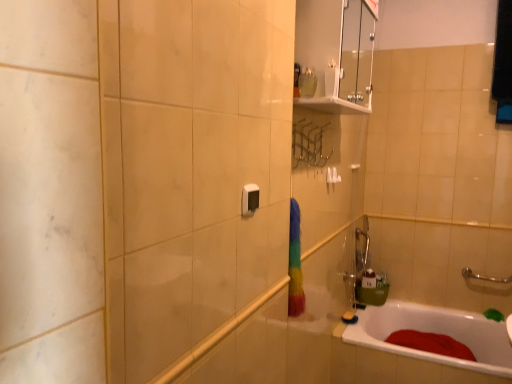
What is the approximate width of satin black switch at center?

It is 0.73 inches.

What do you see at coordinates (250, 199) in the screenshot?
I see `satin black switch at center` at bounding box center [250, 199].

From the picture: What is the approximate height of transparent glass medicine cabinet at upper center?

It is 17.31 inches.

I want to click on white glossy bathtub at lower right, so click(x=435, y=332).

This screenshot has width=512, height=384. I want to click on satin black switch at center, so click(x=250, y=199).

Which is more distant, (313, 41) or (481, 340)?

The point (481, 340) is behind.

Is white glossy bathtub at lower right located within transparent glass medicine cabinet at upper center?

No, white glossy bathtub at lower right is not a part of transparent glass medicine cabinet at upper center.

Can you confirm if transparent glass medicine cabinet at upper center is taller than white glossy bathtub at lower right?

No.

From the image's perspective, does transparent glass medicine cabinet at upper center appear higher than white glossy bathtub at lower right?

Yes.

Is transparent glass medicine cabinet at upper center inside or outside of white plastic towel bar at upper center?

transparent glass medicine cabinet at upper center is located beyond the bounds of white plastic towel bar at upper center.

Considering their positions, is transparent glass medicine cabinet at upper center located in front of or behind white plastic towel bar at upper center?

transparent glass medicine cabinet at upper center is in front of white plastic towel bar at upper center.

Which of these two, transparent glass medicine cabinet at upper center or white plastic towel bar at upper center, is thinner?

white plastic towel bar at upper center is thinner.

How different are the orientations of transparent glass medicine cabinet at upper center and white plastic towel bar at upper center in degrees?

There is a 1.06-degree angle between the facing directions of transparent glass medicine cabinet at upper center and white plastic towel bar at upper center.

Considering the sizes of objects white glossy bathtub at lower right and satin black switch at center in the image provided, who is wider, white glossy bathtub at lower right or satin black switch at center?

With larger width is white glossy bathtub at lower right.

Considering the positions of objects white glossy bathtub at lower right and satin black switch at center in the image provided, who is more to the right, white glossy bathtub at lower right or satin black switch at center?

Positioned to the right is white glossy bathtub at lower right.

Identify the location of light switch located above the white glossy bathtub at lower right (from the image's perspective). (250, 199).

From the image's perspective, is white glossy bathtub at lower right positioned above or below satin black switch at center?

white glossy bathtub at lower right is below satin black switch at center.

Which of these two, satin black switch at center or white glossy bathtub at lower right, is smaller?

With smaller size is satin black switch at center.

From a real-world perspective, is satin black switch at center positioned above or below white glossy bathtub at lower right?

satin black switch at center is above white glossy bathtub at lower right.

Which is correct: satin black switch at center is inside white glossy bathtub at lower right, or outside of it?

satin black switch at center cannot be found inside white glossy bathtub at lower right.

Is point (251, 207) behind point (506, 365)?

That is False.

Which is more to the right, transparent glass medicine cabinet at upper center or satin black switch at center?

Positioned to the right is transparent glass medicine cabinet at upper center.

Is transparent glass medicine cabinet at upper center placed right next to satin black switch at center?

No.

Is point (355, 19) positioned in front of point (251, 196)?

No.

From the image's perspective, does white glossy bathtub at lower right appear lower than white plastic towel bar at upper center?

Yes, from the image's perspective, white glossy bathtub at lower right is below white plastic towel bar at upper center.

Considering the points (406, 355) and (330, 167), which point is behind, point (406, 355) or point (330, 167)?

The point (406, 355) is behind.

Where is `towel bar behind the white glossy bathtub at lower right`? towel bar behind the white glossy bathtub at lower right is located at coordinates pos(332,176).

In the image, is white glossy bathtub at lower right positioned in front of or behind white plastic towel bar at upper center?

In the image, white glossy bathtub at lower right appears in front of white plastic towel bar at upper center.

Would you say satin black switch at center is part of white plastic towel bar at upper center's contents?

No, satin black switch at center is not inside white plastic towel bar at upper center.

Consider the image. Which is closer to the camera, (x=338, y=182) or (x=243, y=189)?

The point (x=243, y=189) is in front.

From the image's perspective, does white plastic towel bar at upper center appear lower than satin black switch at center?

Incorrect, from the image's perspective, white plastic towel bar at upper center is higher than satin black switch at center.

Considering the relative positions of white plastic towel bar at upper center and satin black switch at center in the image provided, is white plastic towel bar at upper center behind satin black switch at center?

Yes.

The width and height of the screenshot is (512, 384). What are the coordinates of `medicine cabinet in front of the white glossy bathtub at lower right` in the screenshot? It's located at (336, 54).

Identify the location of towel bar that is on the right side of transparent glass medicine cabinet at upper center. This screenshot has width=512, height=384. (332, 176).

In the scene shown: From the image, which object appears to be nearer to satin black switch at center, white plastic towel bar at upper center or transparent glass medicine cabinet at upper center?

white plastic towel bar at upper center lies closer to satin black switch at center than the other object.

Considering their positions, is transparent glass medicine cabinet at upper center positioned closer to white glossy bathtub at lower right than white plastic towel bar at upper center?

The object closer to white glossy bathtub at lower right is white plastic towel bar at upper center.

Estimate the real-world distances between objects in this image. Which object is further from satin black switch at center, white plastic towel bar at upper center or white glossy bathtub at lower right?

Among the two, white glossy bathtub at lower right is located further to satin black switch at center.

Based on their spatial positions, is satin black switch at center or white glossy bathtub at lower right closer to transparent glass medicine cabinet at upper center?

white glossy bathtub at lower right.

Based on their spatial positions, is satin black switch at center or transparent glass medicine cabinet at upper center closer to white plastic towel bar at upper center?

Among the two, transparent glass medicine cabinet at upper center is located nearer to white plastic towel bar at upper center.

In the scene shown: Which object lies nearer to the anchor point white plastic towel bar at upper center, white glossy bathtub at lower right or transparent glass medicine cabinet at upper center?

Based on the image, transparent glass medicine cabinet at upper center appears to be nearer to white plastic towel bar at upper center.

Considering their positions, is transparent glass medicine cabinet at upper center positioned closer to satin black switch at center than white plastic towel bar at upper center?

white plastic towel bar at upper center is closer to satin black switch at center.

When comparing their distances from transparent glass medicine cabinet at upper center, does white plastic towel bar at upper center or white glossy bathtub at lower right seem closer?

white plastic towel bar at upper center is closer to transparent glass medicine cabinet at upper center.

I want to click on light switch between white plastic towel bar at upper center and white glossy bathtub at lower right from top to bottom, so click(250, 199).

Identify the location of towel bar between transparent glass medicine cabinet at upper center and white glossy bathtub at lower right from top to bottom. This screenshot has height=384, width=512. (332, 176).

Locate an element on the screen. Image resolution: width=512 pixels, height=384 pixels. medicine cabinet between satin black switch at center and white plastic towel bar at upper center in the front-back direction is located at coordinates (336, 54).

Identify the location of light switch between transparent glass medicine cabinet at upper center and white glossy bathtub at lower right vertically. Image resolution: width=512 pixels, height=384 pixels. (250, 199).